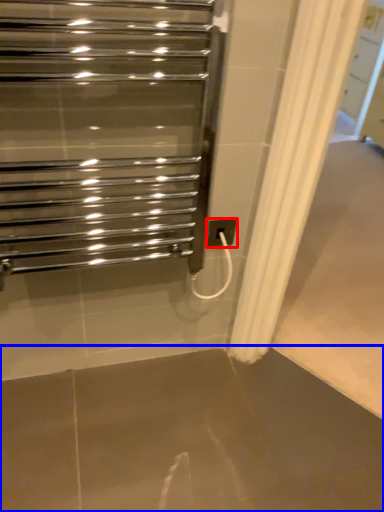
Question: Which object appears closest to the camera in this image, electric outlet (highlighted by a red box) or concrete (highlighted by a blue box)?

Choices:
 (A) electric outlet
 (B) concrete

Answer: (B)